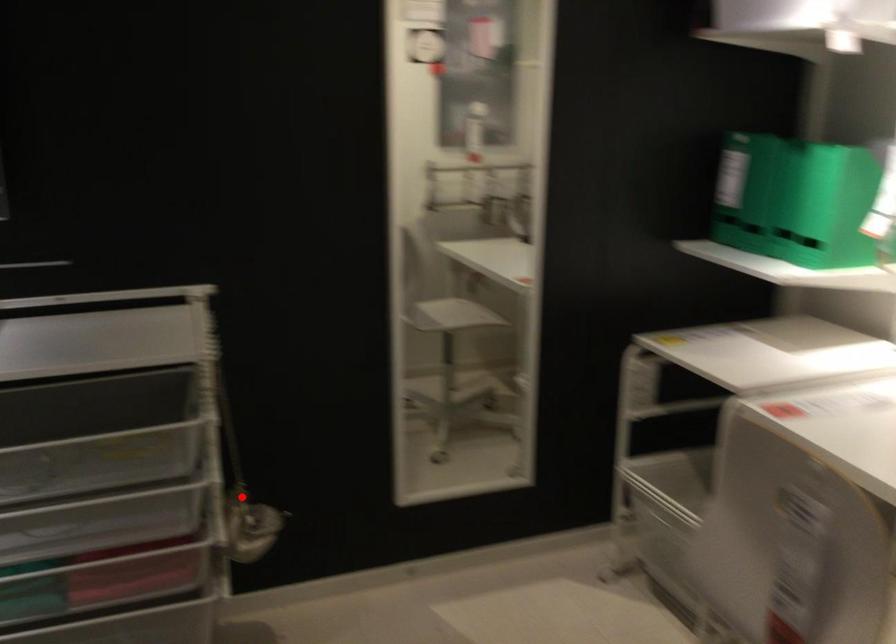
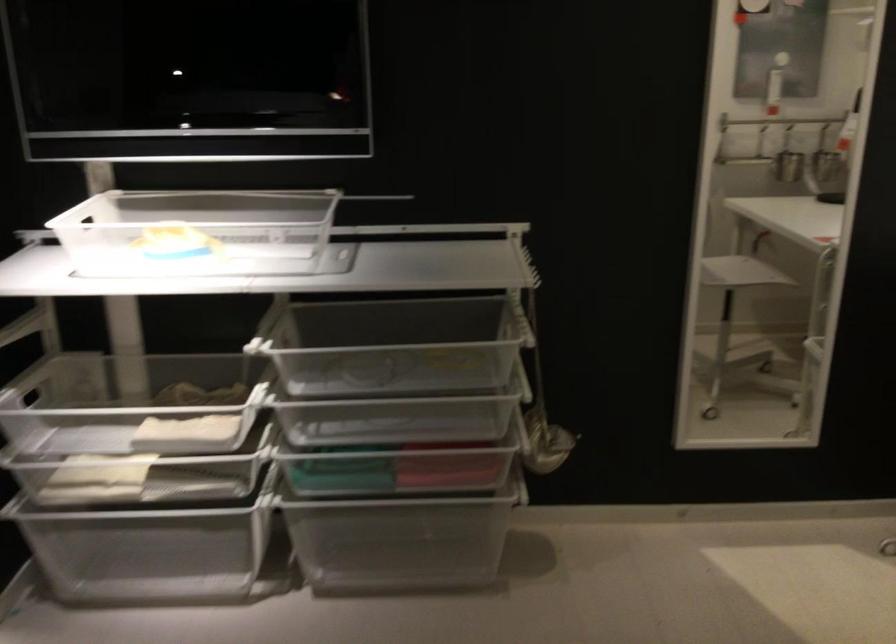
The point at the highlighted location is marked in the first image. Where is the corresponding point in the second image?

(541, 415)